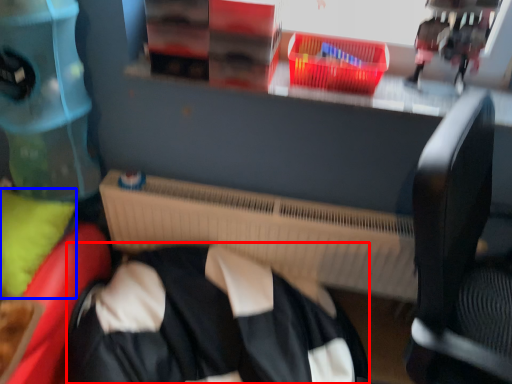
Question: Which point is further to the camera, clothing (highlighted by a red box) or pillow (highlighted by a blue box)?

Choices:
 (A) clothing
 (B) pillow

Answer: (B)